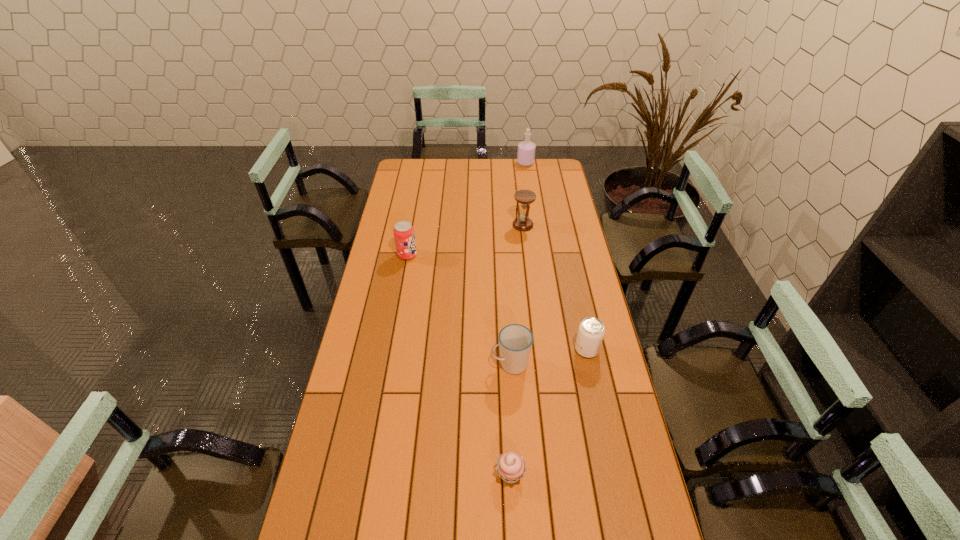
The width and height of the screenshot is (960, 540). Identify the location of the farthest object. (526, 149).

At what (x,y) coordinates should I click in order to perform the action: click on perfume. Please return your answer as a coordinate pair (x, y). Looking at the image, I should click on (526, 149).

Locate an element on the screen. hourglass is located at coordinates (525, 197).

Find the location of a particular element. The height and width of the screenshot is (540, 960). the fourth nearest object is located at coordinates (404, 235).

This screenshot has width=960, height=540. Find the location of `the farther soda can`. the farther soda can is located at coordinates (404, 235).

At what (x,y) coordinates should I click in order to perform the action: click on cup. Please return your answer as a coordinate pair (x, y). This screenshot has height=540, width=960. Looking at the image, I should click on (515, 341).

This screenshot has width=960, height=540. Find the location of `the right soda can`. the right soda can is located at coordinates (591, 331).

The image size is (960, 540). What are the coordinates of `the rightmost object` in the screenshot? It's located at (591, 331).

Locate an element on the screen. The width and height of the screenshot is (960, 540). the nearest object is located at coordinates (511, 467).

You are a GUI agent. You are given a task and a screenshot of the screen. Output one action in this format:
    pyautogui.click(x=<x>, y=<y>)
    Task: Click on the cupcake
    The image size is (960, 540).
    Given the screenshot: What is the action you would take?
    pyautogui.click(x=511, y=467)